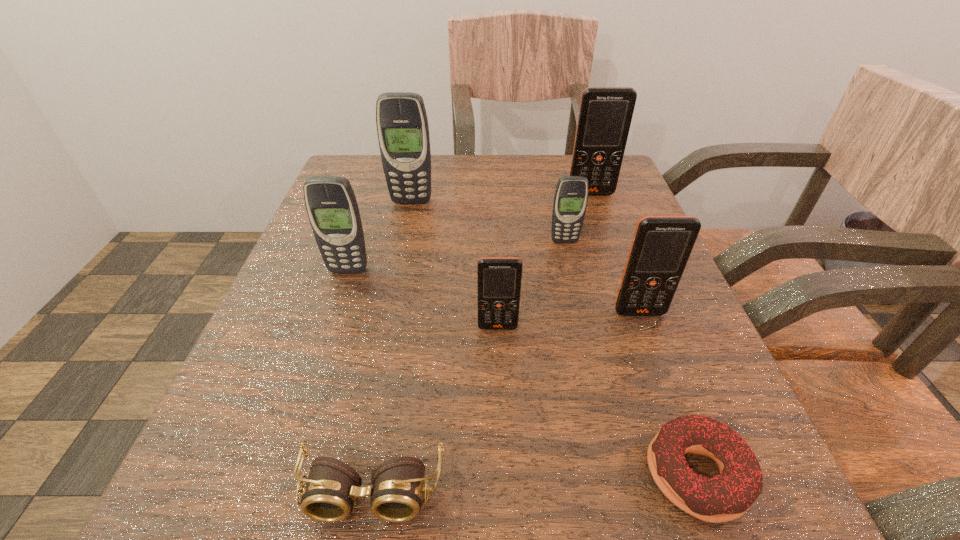
Where is `the farthest object`? the farthest object is located at coordinates (605, 114).

Image resolution: width=960 pixels, height=540 pixels. I want to click on the farthest cellular telephone, so click(x=605, y=114).

You are a GUI agent. You are given a task and a screenshot of the screen. Output one action in this format:
    pyautogui.click(x=<x>, y=<y>)
    Task: Click on the farthest gray cellular telephone
    
    Given the screenshot: What is the action you would take?
    pyautogui.click(x=402, y=125)

Locate an element on the screen. The image size is (960, 540). the second farthest cellular telephone is located at coordinates click(402, 125).

This screenshot has width=960, height=540. What are the coordinates of `the nearest gray cellular telephone` in the screenshot? It's located at (331, 205).

You are a GUI agent. You are given a task and a screenshot of the screen. Output one action in this format:
    pyautogui.click(x=<x>, y=<y>)
    Task: Click on the fourth farthest object
    The width and height of the screenshot is (960, 540).
    Given the screenshot: What is the action you would take?
    pyautogui.click(x=331, y=205)

Where is `the fourth nearest object`? the fourth nearest object is located at coordinates (661, 246).

At what (x,y) coordinates should I click in order to perform the action: click on the second smallest orange cellular telephone. Please return your answer as a coordinate pair (x, y). Image resolution: width=960 pixels, height=540 pixels. Looking at the image, I should click on (661, 246).

Image resolution: width=960 pixels, height=540 pixels. I want to click on the smallest orange cellular telephone, so click(x=499, y=279).

Find the location of a particular element. The image size is (960, 540). the sixth farthest object is located at coordinates (499, 279).